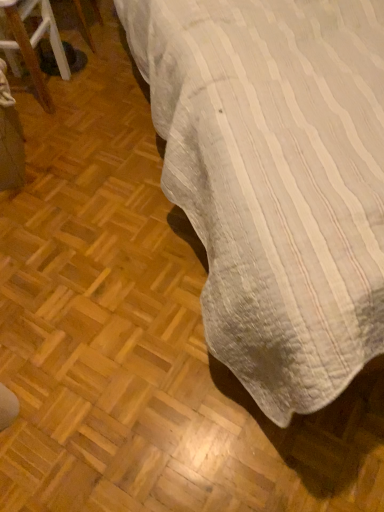
This screenshot has width=384, height=512. I want to click on vacant space underneath black fabric bag at left (from a real-world perspective), so click(47, 95).